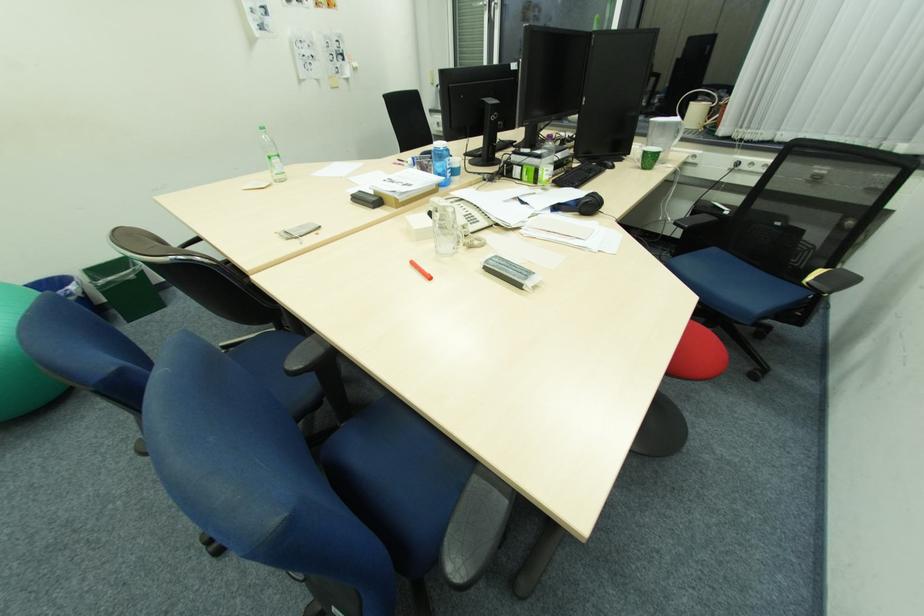
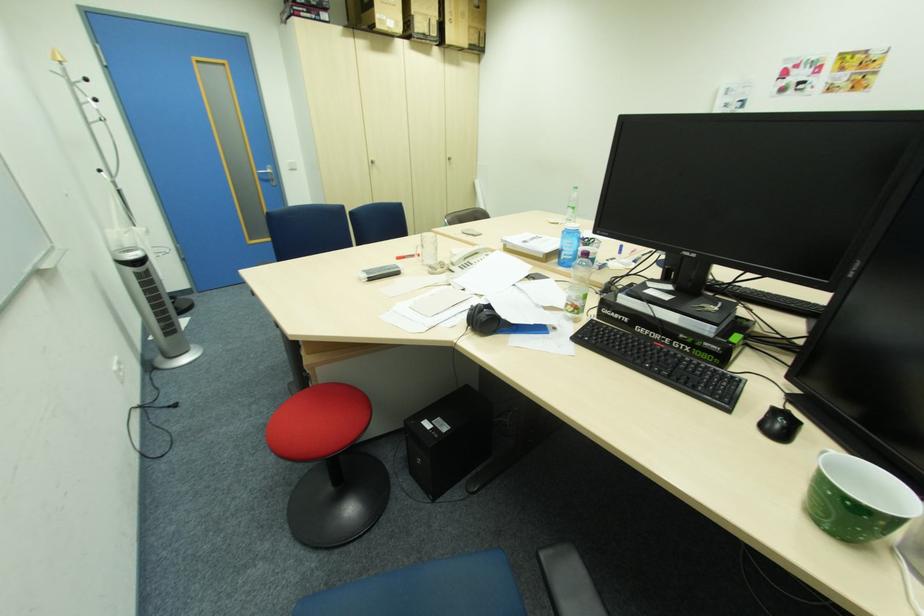
In the second image, find the point that corresponds to the point at 469,217 in the first image.

(475, 262)